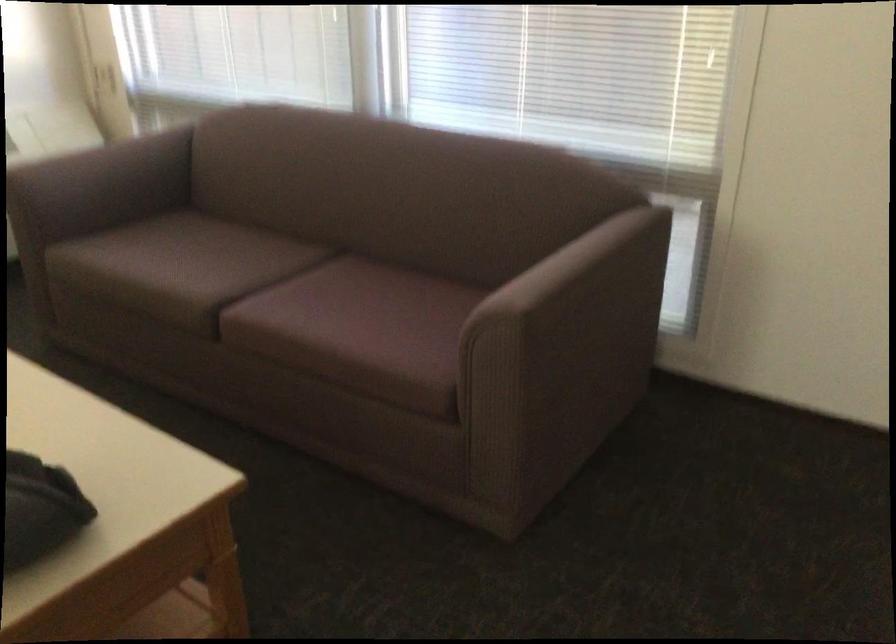
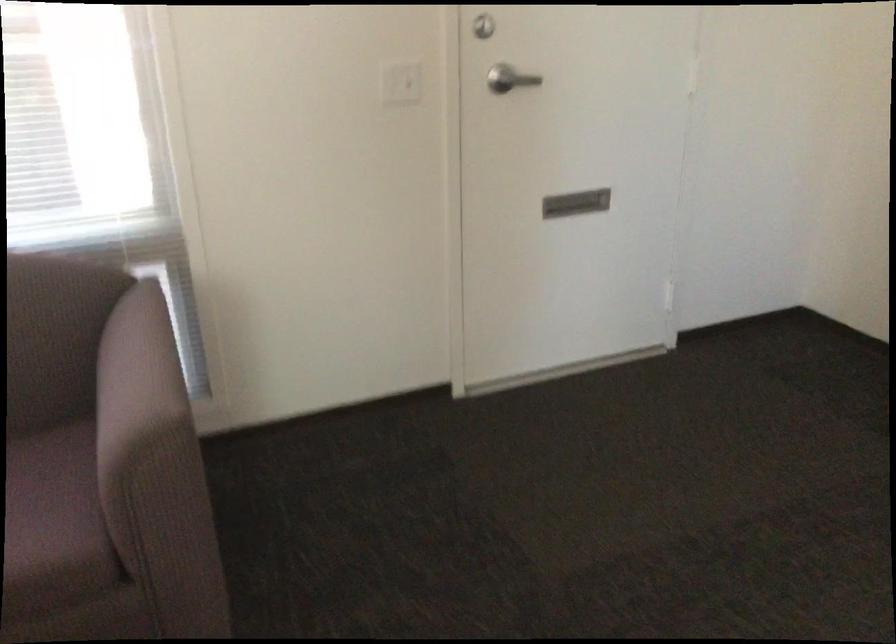
In the second image, find the point that corresponds to point (532, 270) in the first image.

(136, 381)